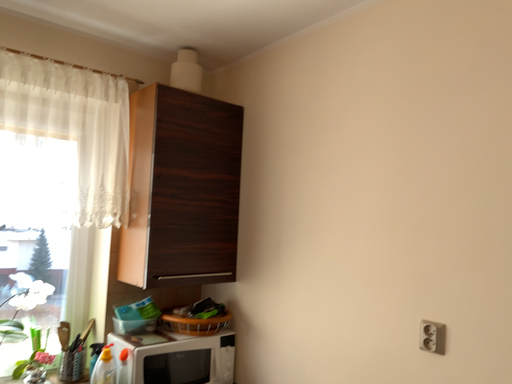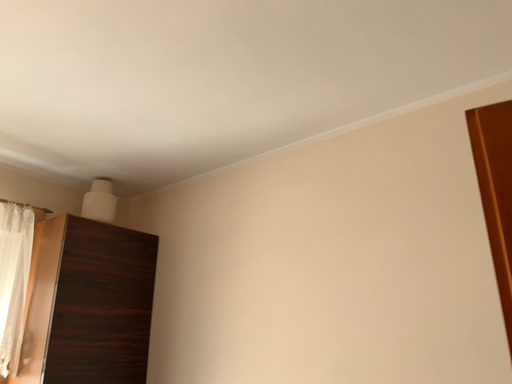
Question: How did the camera likely rotate when shooting the video?

Choices:
 (A) rotated right
 (B) rotated left

Answer: (A)